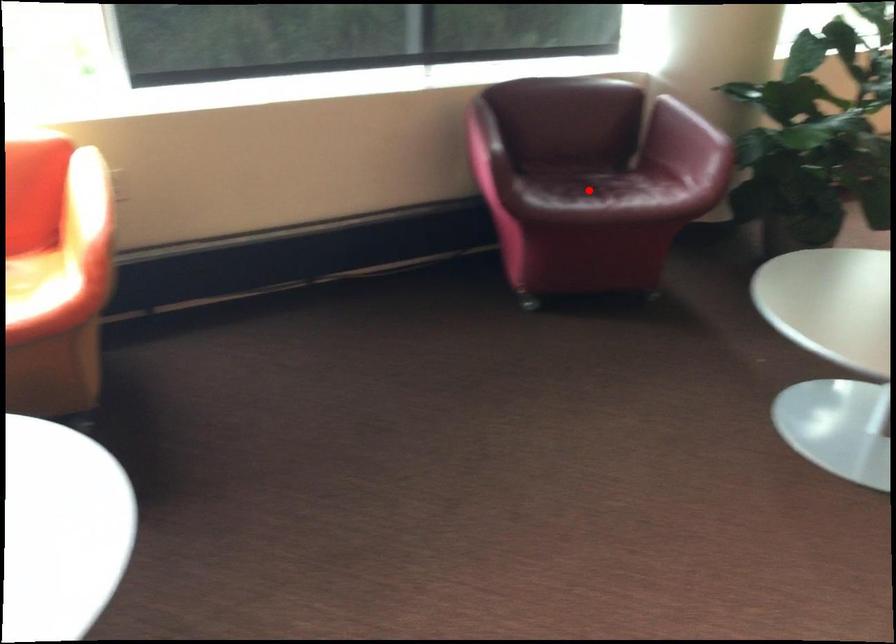
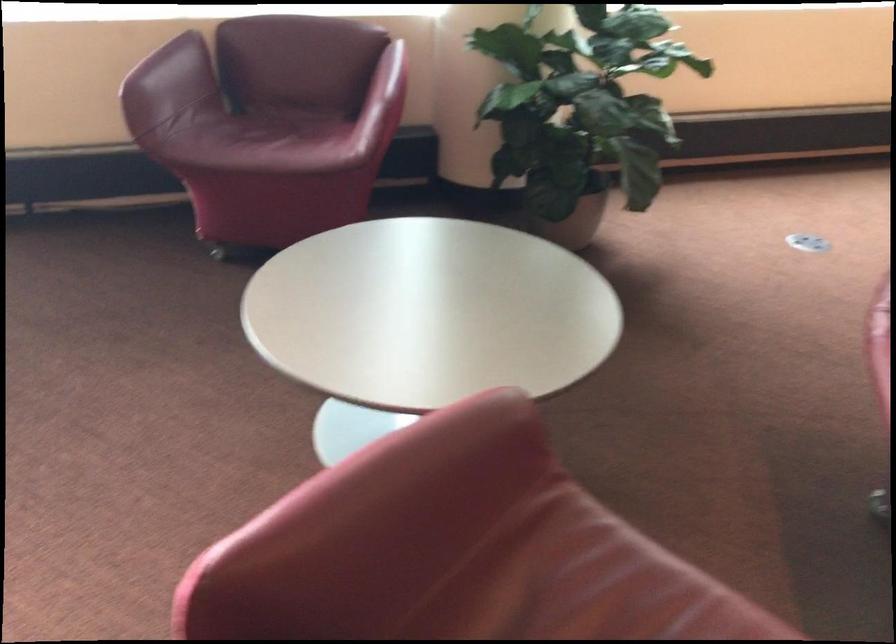
Locate, in the second image, the point that corresponds to the highlighted location in the first image.

(263, 140)